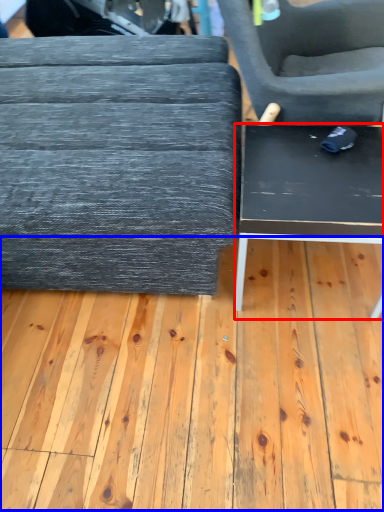
Question: Which object appears farthest to the camera in this image, table (highlighted by a red box) or plywood (highlighted by a blue box)?

Choices:
 (A) table
 (B) plywood

Answer: (A)